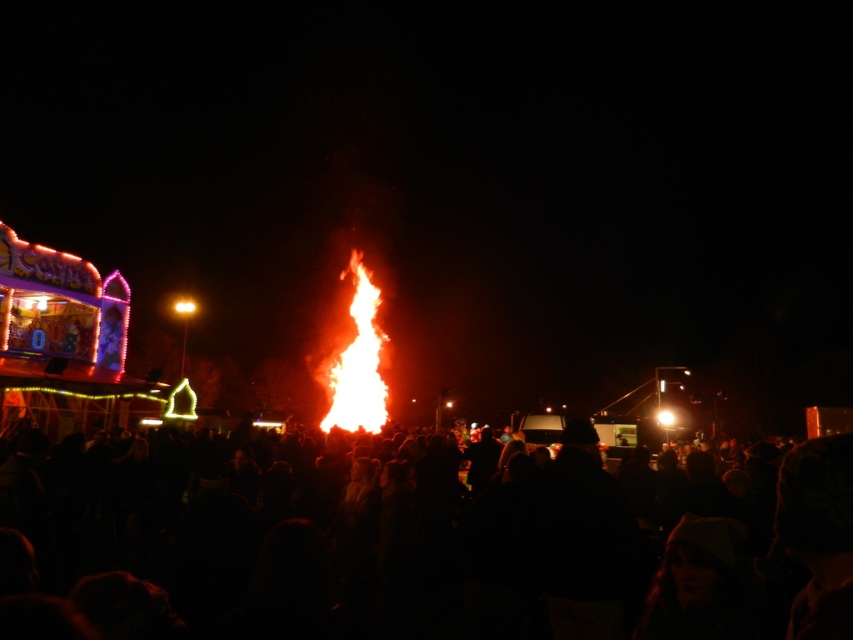
Question: Which of the following is the closest to the observer?

Choices:
 (A) (123, 480)
 (B) (335, 372)

Answer: (A)

Question: Can you confirm if black matte crowd at center is thinner than flame at center?

Choices:
 (A) yes
 (B) no

Answer: (B)

Question: Is black matte crowd at center below flame at center?

Choices:
 (A) no
 (B) yes

Answer: (B)

Question: Is black matte crowd at center below flame at center?

Choices:
 (A) no
 (B) yes

Answer: (B)

Question: Which of the following is the farthest from the observer?

Choices:
 (A) black matte crowd at center
 (B) flame at center

Answer: (B)